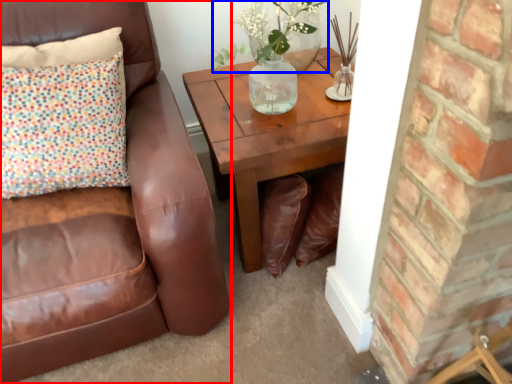
Question: Among these objects, which one is nearest to the camera, chair (highlighted by a red box) or floral arrangement (highlighted by a blue box)?

Choices:
 (A) chair
 (B) floral arrangement

Answer: (A)